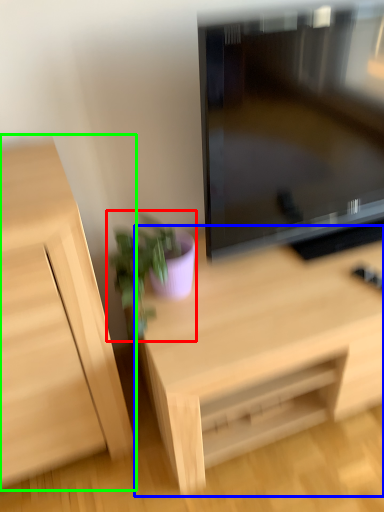
Question: Considering the real-world distances, which object is farthest from houseplant (highlighted by a red box)? desk (highlighted by a blue box) or cabinetry (highlighted by a green box)?

Choices:
 (A) desk
 (B) cabinetry

Answer: (A)